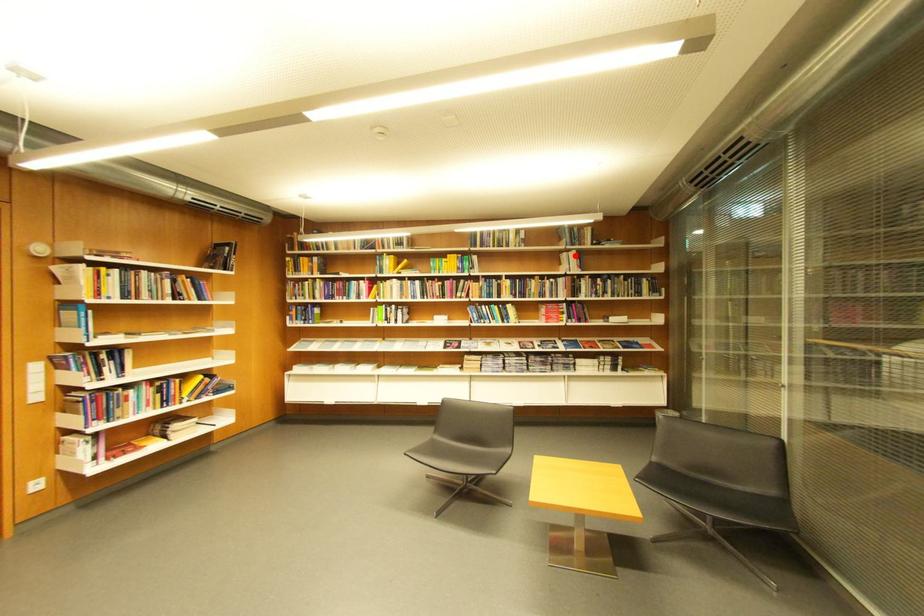
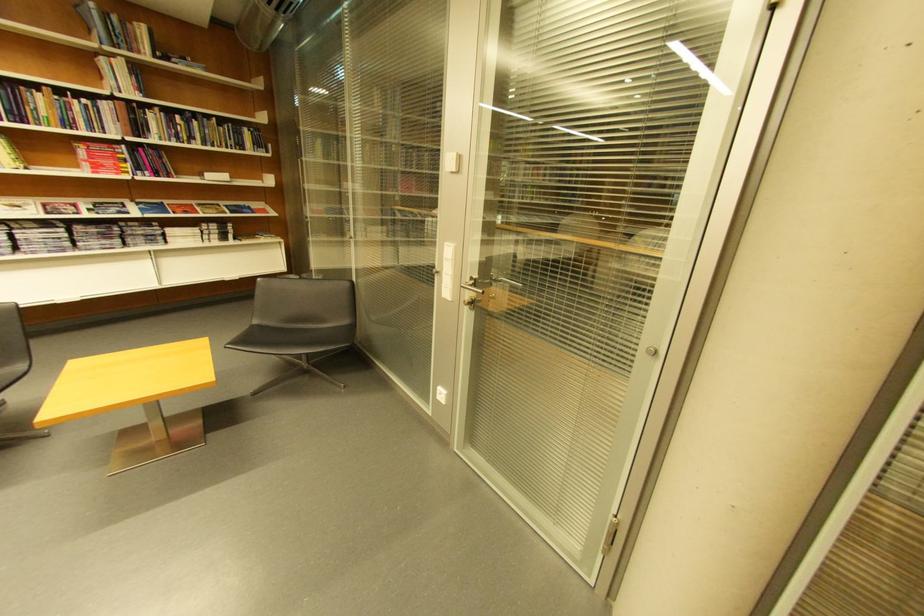
The point at the highlighted location is marked in the first image. Where is the corresponding point in the second image?

(113, 62)